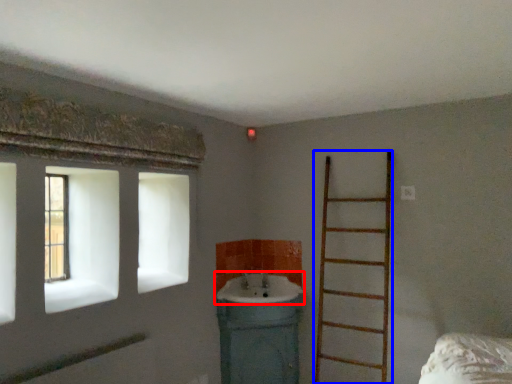
Question: Which object appears farthest to the camera in this image, sink (highlighted by a red box) or ladder (highlighted by a blue box)?

Choices:
 (A) sink
 (B) ladder

Answer: (A)